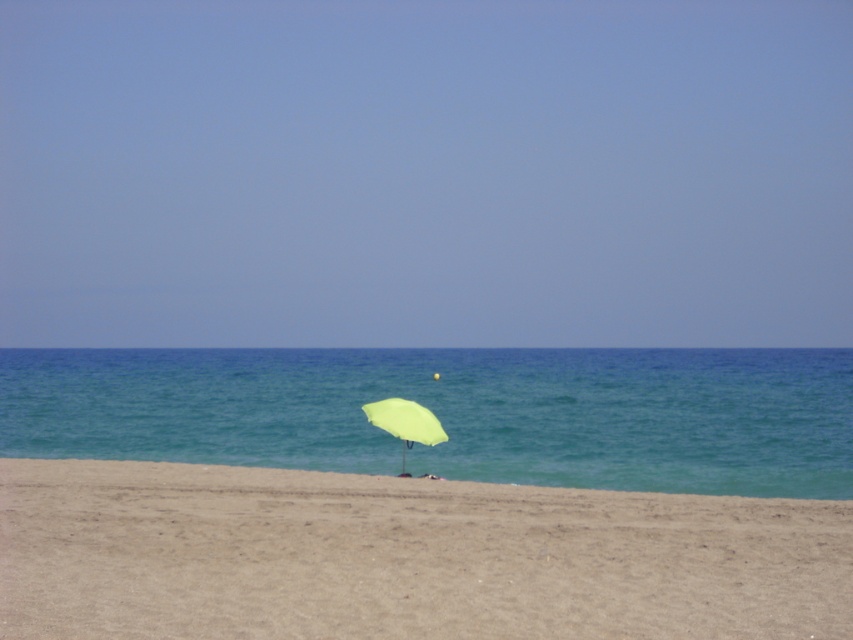
Can you confirm if beige sandy beach at center is shorter than light green fabric umbrella at center?

Indeed, beige sandy beach at center has a lesser height compared to light green fabric umbrella at center.

What do you see at coordinates (403, 557) in the screenshot? The height and width of the screenshot is (640, 853). I see `beige sandy beach at center` at bounding box center [403, 557].

Who is more distant from viewer, (148, 522) or (398, 412)?

Point (398, 412)

You are a GUI agent. You are given a task and a screenshot of the screen. Output one action in this format:
    pyautogui.click(x=<x>, y=<y>)
    Task: Click on the beige sandy beach at center
    This screenshot has height=640, width=853.
    Given the screenshot: What is the action you would take?
    pyautogui.click(x=403, y=557)

Does point (7, 509) come behind point (425, 365)?

No, (7, 509) is in front of (425, 365).

Can you confirm if beige sandy beach at center is positioned to the right of transparent blue water at center?

Yes, beige sandy beach at center is to the right of transparent blue water at center.

What do you see at coordinates (403, 557) in the screenshot? I see `beige sandy beach at center` at bounding box center [403, 557].

Locate an element on the screen. The image size is (853, 640). beige sandy beach at center is located at coordinates (403, 557).

Between transparent blue water at center and light green fabric umbrella at center, which one is positioned higher?

transparent blue water at center is higher up.

Does transparent blue water at center appear on the left side of light green fabric umbrella at center?

No, transparent blue water at center is not to the left of light green fabric umbrella at center.

Is point (415, 458) more distant than point (370, 403)?

Yes, it is behind point (370, 403).

This screenshot has width=853, height=640. What are the coordinates of `transparent blue water at center` in the screenshot? It's located at (453, 412).